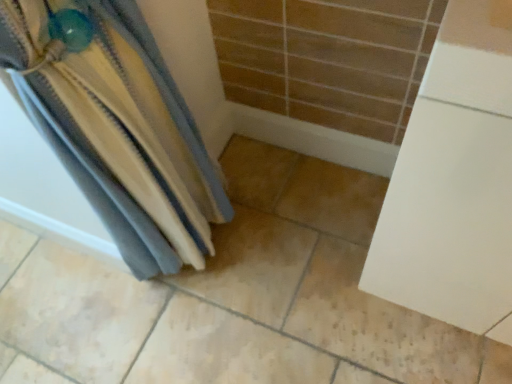
Locate an element on the screen. silky blue curtain at left is located at coordinates (116, 126).

Image resolution: width=512 pixels, height=384 pixels. What do you see at coordinates (116, 126) in the screenshot?
I see `silky blue curtain at left` at bounding box center [116, 126].

In order to click on silky blue curtain at left in this screenshot , I will do `click(116, 126)`.